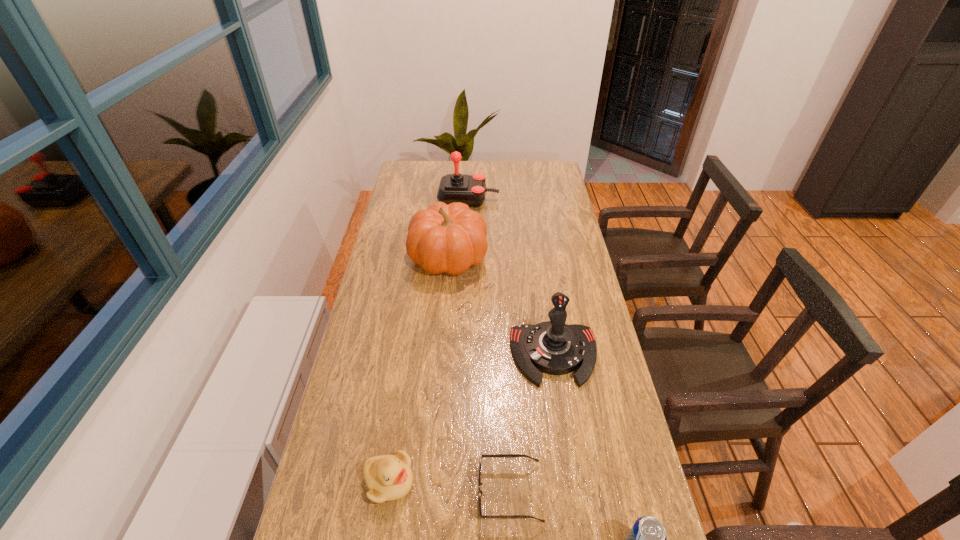
Locate which object is the fifth closest to the left joystick. Please provide its 2D coordinates. Your answer should be formatted as a tuple, i.e. [(x, y)], where the tuple contains the x and y coordinates of a point satisfying the conditions above.

[(647, 539)]

Identify the location of vacant region that satisfies the following two spatial constraints: 1. on the handle side of the right joystick; 2. on the beak of the duckling. This screenshot has width=960, height=540. (x=574, y=482).

Locate an element on the screen. The height and width of the screenshot is (540, 960). free region that satisfies the following two spatial constraints: 1. on the handle side of the nearer joystick; 2. at the front lenses of the shortest object is located at coordinates (575, 492).